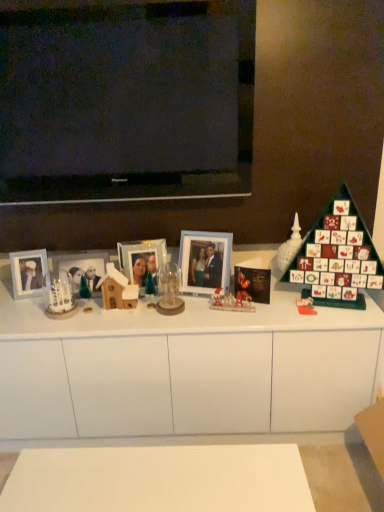
Where is `vacant space that's between translucent plastic figurines at center, placed as the 3th toy when sorted from left to right, and matte plastic toy at right, the 5th toy viewed from the left`? The width and height of the screenshot is (384, 512). vacant space that's between translucent plastic figurines at center, placed as the 3th toy when sorted from left to right, and matte plastic toy at right, the 5th toy viewed from the left is located at coordinates (268, 308).